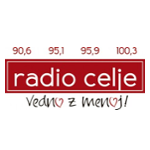
I want to click on radio, so click(34, 76).